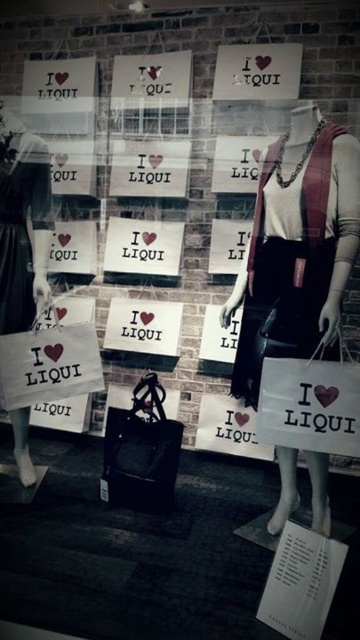
Question: Can you confirm if white paper bag at left is positioned above black satin dress at left?

Choices:
 (A) yes
 (B) no

Answer: (A)

Question: Can you confirm if matte black dress at center is positioned to the left of black satin dress at left?

Choices:
 (A) yes
 (B) no

Answer: (B)

Question: Considering the real-world distances, which object is farthest from the black satin dress at left?

Choices:
 (A) matte black dress at center
 (B) white paper bag at left

Answer: (A)

Question: Can you confirm if matte black dress at center is positioned to the right of white paper bag at left?

Choices:
 (A) yes
 (B) no

Answer: (A)

Question: Which object is closer to the camera taking this photo?

Choices:
 (A) black satin dress at left
 (B) matte black dress at center

Answer: (B)

Question: Which object appears farthest from the camera in this image?

Choices:
 (A) white paper bag at left
 (B) black satin dress at left

Answer: (A)